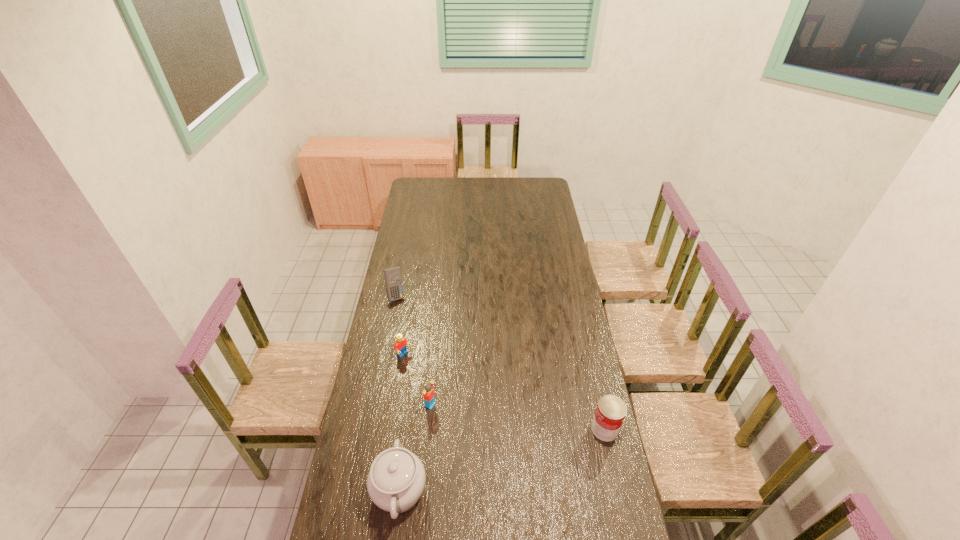
I want to click on empty space between the nearest object and the farthest object, so click(x=397, y=393).

Locate an element on the screen. The height and width of the screenshot is (540, 960). free area in between the rightmost object and the farthest object is located at coordinates tap(500, 362).

Identify the location of free space that is in between the chinaware and the can. (502, 460).

In order to click on blank region between the right Lego and the left Lego in this screenshot , I will do `click(418, 380)`.

Locate an element on the screen. The height and width of the screenshot is (540, 960). vacant space that's between the third nearest object and the leftmost object is located at coordinates (413, 350).

I want to click on free spot between the chinaware and the rightmost object, so click(x=502, y=460).

Image resolution: width=960 pixels, height=540 pixels. Identify the location of free point between the leftmost object and the nearest object. (397, 393).

The width and height of the screenshot is (960, 540). Find the location of `free point between the farther Lego and the fourth farthest object`. free point between the farther Lego and the fourth farthest object is located at coordinates (504, 392).

Where is `empty space that is in between the farthest object and the chinaware`? empty space that is in between the farthest object and the chinaware is located at coordinates (397, 393).

Locate which object ranks second in proximity to the right Lego. Please provide its 2D coordinates. Your answer should be formatted as a tuple, i.e. [(x, y)], where the tuple contains the x and y coordinates of a point satisfying the conditions above.

[(400, 344)]